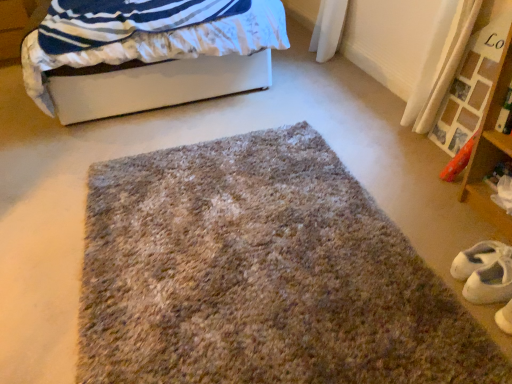
Locate an element on the screen. This screenshot has width=512, height=384. free space that is in between wooden shelf at right and fuzzy carpet at center is located at coordinates point(395,191).